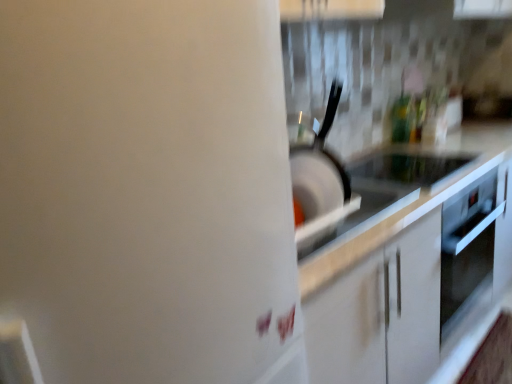
Question: Choose the correct answer: Is white glossy countertop at center inside black glass cooktop at center or outside it?

Choices:
 (A) inside
 (B) outside

Answer: (B)

Question: Is white glossy countertop at center in front of or behind black glass cooktop at center in the image?

Choices:
 (A) front
 (B) behind

Answer: (A)

Question: Which object is the closest to the white glossy water heater at upper right?

Choices:
 (A) white glossy countertop at center
 (B) black matte frying pan at center
 (C) black glass cooktop at center

Answer: (B)

Question: Which is farther from the white glossy countertop at center?

Choices:
 (A) white glossy water heater at upper right
 (B) black glass cooktop at center
 (C) black matte frying pan at center

Answer: (A)